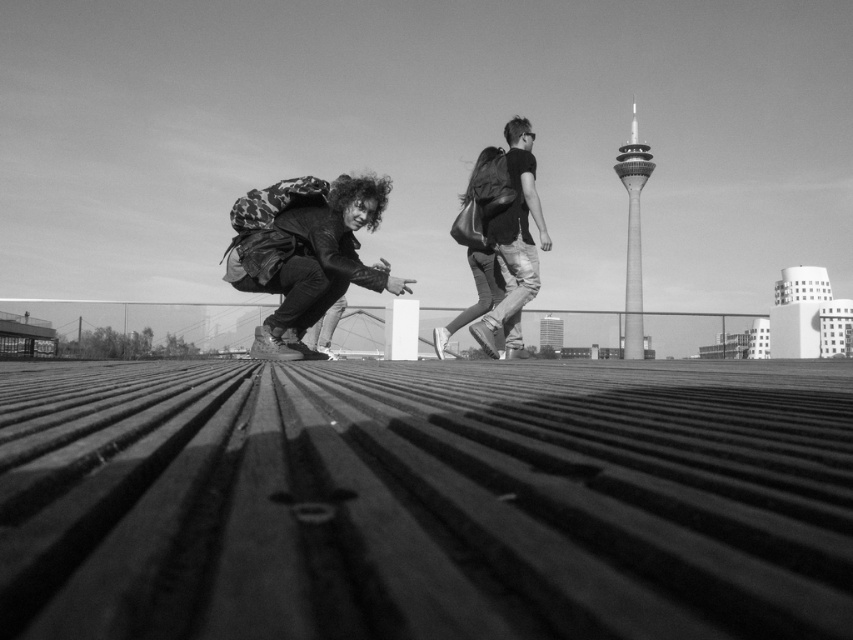
Based on the scene described, can you determine which object takes up more area in the image between the camouflage backpack at center and the smooth metallic tower at upper right?

The smooth metallic tower at upper right takes up more area in the image than the camouflage backpack at center, as the camouflage backpack at center occupies less space than smooth metallic tower at upper right.

Consider the image. You are standing on the wooden platform and want to pick up the camouflage backpack at center and the leather backpack at center. Which one do you need to walk towards to reach first?

You need to walk towards the leather backpack at center first because the camouflage backpack at center is closer to you, so you can reach it without moving, but the leather backpack at center is farther away and requires walking towards it.